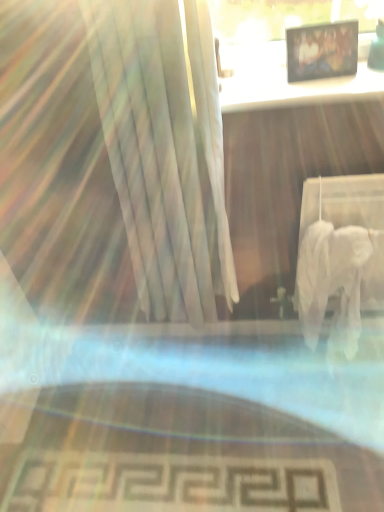
Image resolution: width=384 pixels, height=512 pixels. Find the location of `free spot in front of wooden photo frame at upper center`. free spot in front of wooden photo frame at upper center is located at coordinates (332, 88).